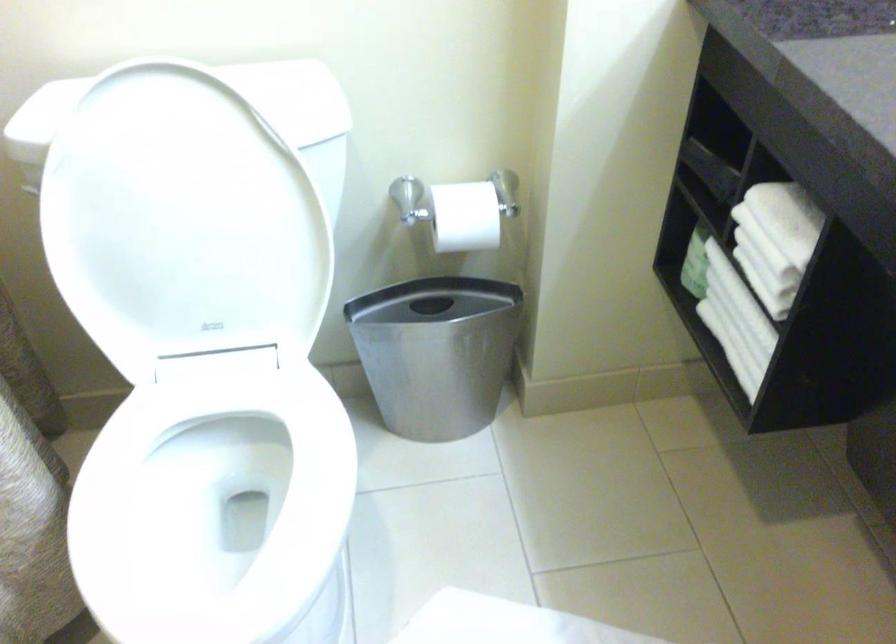
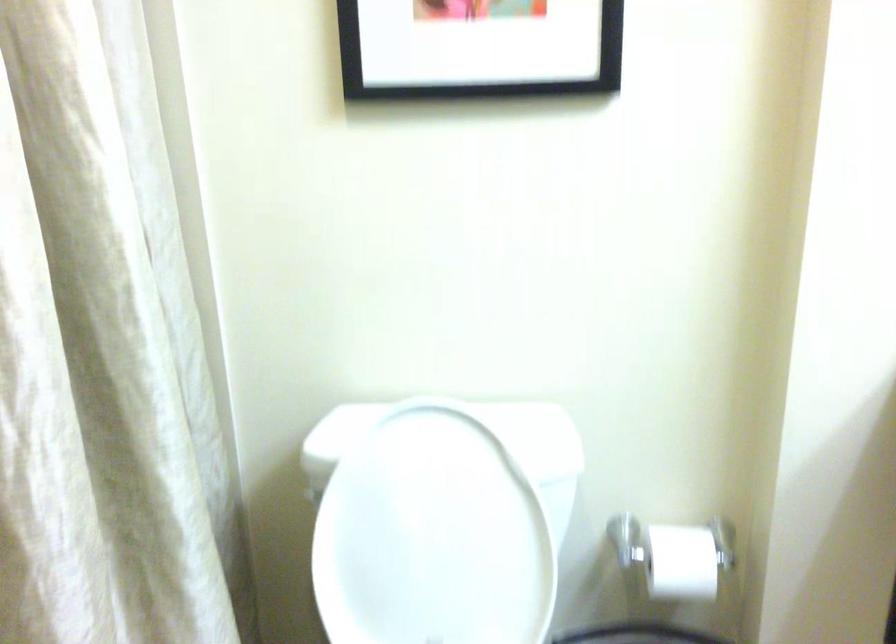
Locate, in the second image, the point that corresponds to pixel 467 214 in the first image.

(682, 562)